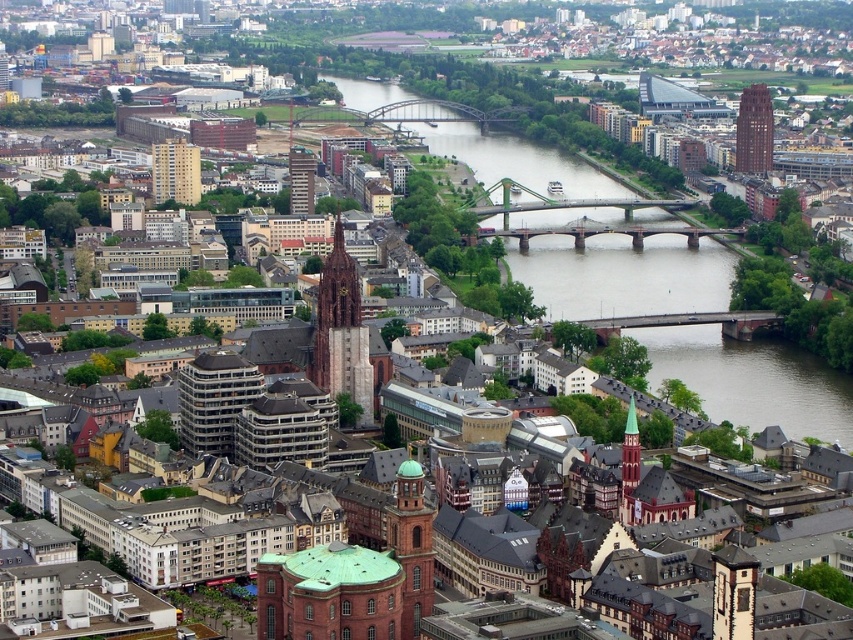
You are a drone operator flying over the city. Your drone is currently above the brown stone bridge at center and the red brick tower at center. Which structure is closer to your drone?

The brown stone bridge at center is closer to your drone because it is further to the viewer than the red brick tower at center, meaning it appears nearer in the aerial view.